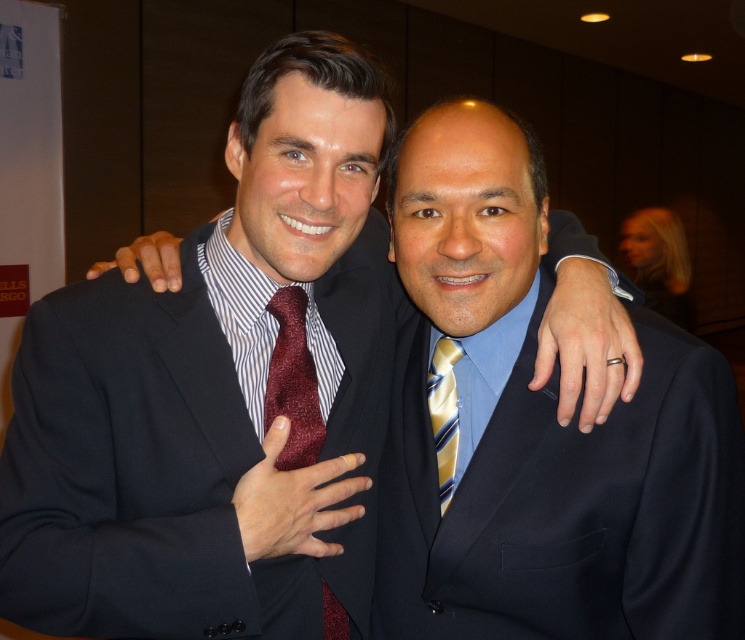
Question: Does maroon textured tie at center appear over yellow striped tie at center?

Choices:
 (A) yes
 (B) no

Answer: (B)

Question: Which of the following is the closest to the observer?

Choices:
 (A) (448, 406)
 (B) (297, 358)

Answer: (B)

Question: Is matte black suit at left below matte black suit at center?

Choices:
 (A) yes
 (B) no

Answer: (B)

Question: Estimate the real-world distances between objects in this image. Which object is farther from the matte black suit at left?

Choices:
 (A) yellow striped tie at center
 (B) matte black suit at center
 (C) maroon textured tie at center

Answer: (A)

Question: In this image, where is matte black suit at left located relative to maroon textured tie at center?

Choices:
 (A) right
 (B) left

Answer: (B)

Question: Considering the real-world distances, which object is closest to the yellow striped tie at center?

Choices:
 (A) maroon textured tie at center
 (B) matte black suit at center
 (C) matte black suit at left

Answer: (B)